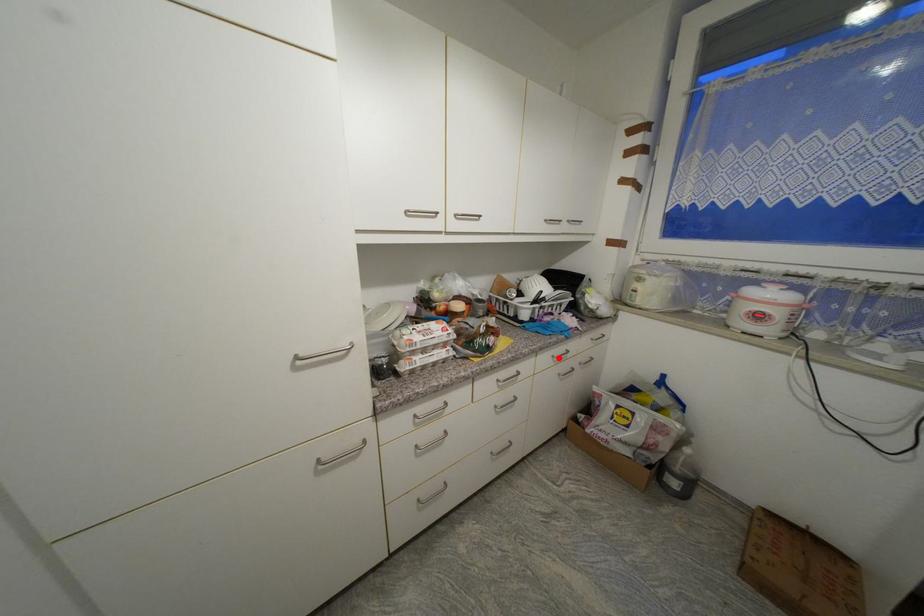
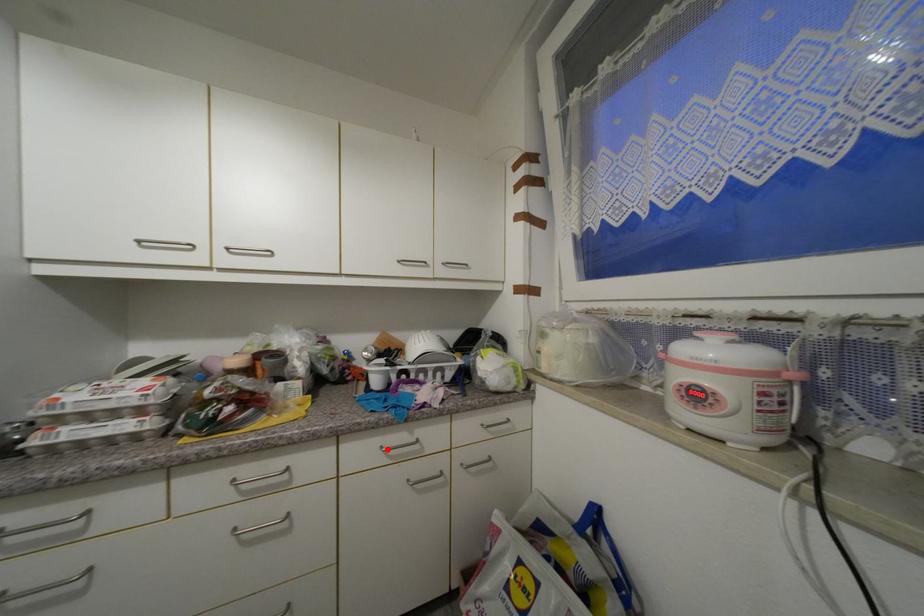
I am providing you with two images of the same scene from different viewpoints. A red point is marked on the first image and another point is marked on the second image. Do the highlighted points in image1 and image2 indicate the same real-world spot?

Yes